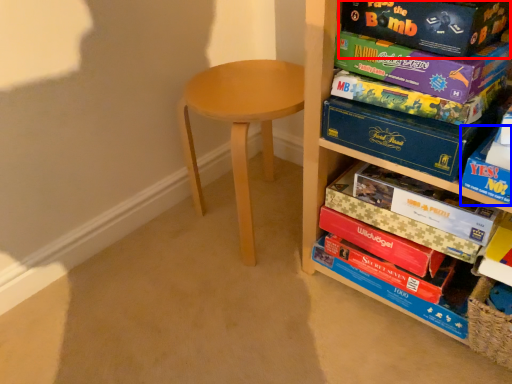
Question: Which point is closer to the camera, paperback book (highlighted by a red box) or storage box (highlighted by a blue box)?

Choices:
 (A) paperback book
 (B) storage box

Answer: (B)